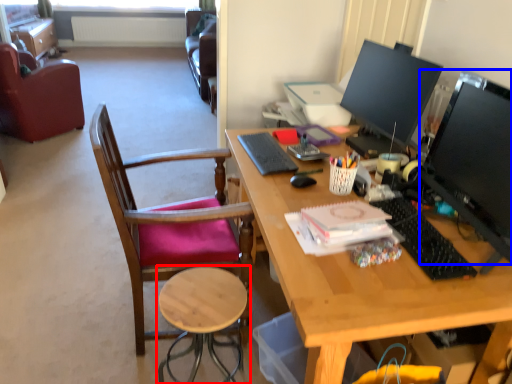
Question: Which point is closer to the camera, stool (highlighted by a red box) or television (highlighted by a blue box)?

Choices:
 (A) stool
 (B) television

Answer: (B)